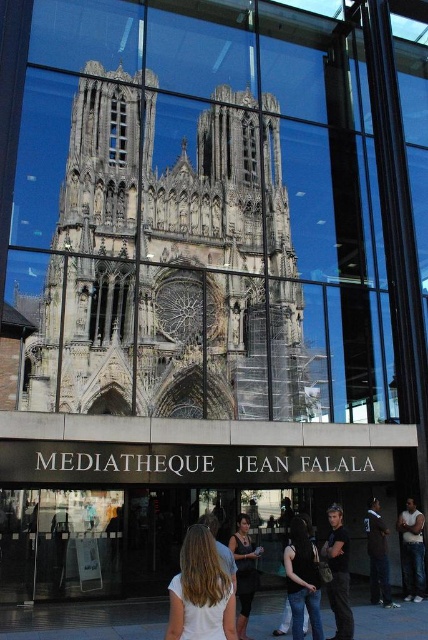
You are standing in front of the mediatheque and want to take a photo of the entrance. Where should you position yourself to ensure the blonde hair at center is in the frame?

Position yourself so that the blonde hair at center is centered in your viewfinder, as it is located at point 0.925 on the x axis and 0.470 on the y axis.

You are a visitor standing in front of the mediatheque entrance. You notice a person with blonde hair at center and a clear glass window at center. Which object is positioned higher relative to the other?

The clear glass window at center is positioned higher than the blonde hair at center because the blonde hair at center is located below it.

You are an architect visiting the mediatheque and want to take a photo of both the stone gothic cathedral at center and the clear glass window at center. Which object should you focus on first if you want to capture both in a single frame without moving the camera?

The stone gothic cathedral at center is bigger than the clear glass window at center, so you should focus on the stone gothic cathedral at center first to ensure it fits properly in the frame before adjusting for the smaller clear glass window at center.